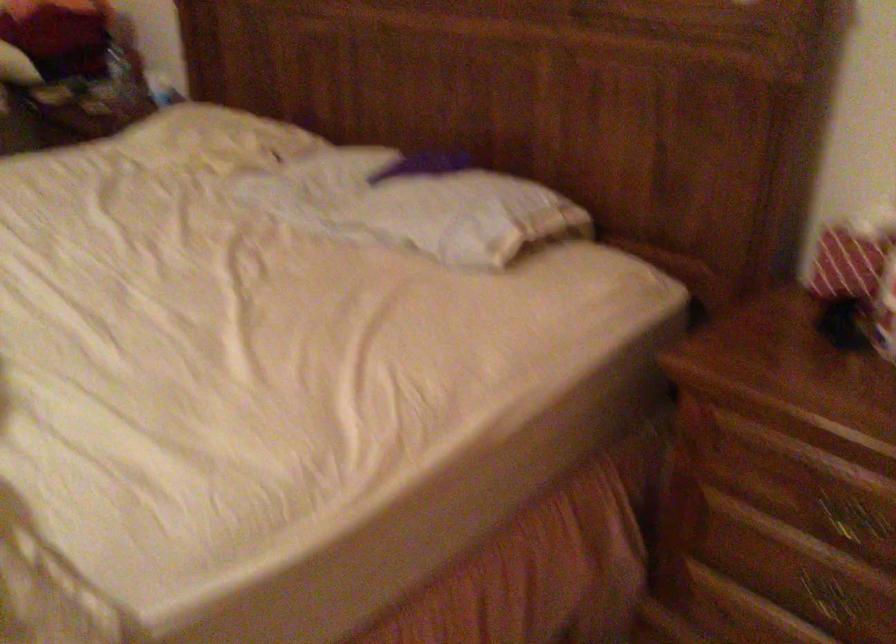
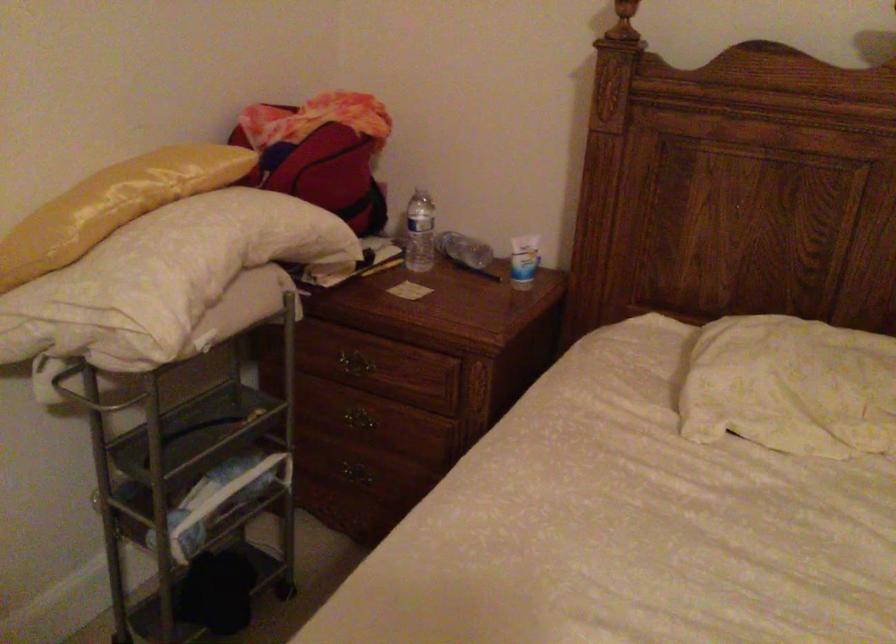
Locate, in the second image, the point that corresponds to the point at 73,140 in the first image.

(350, 365)